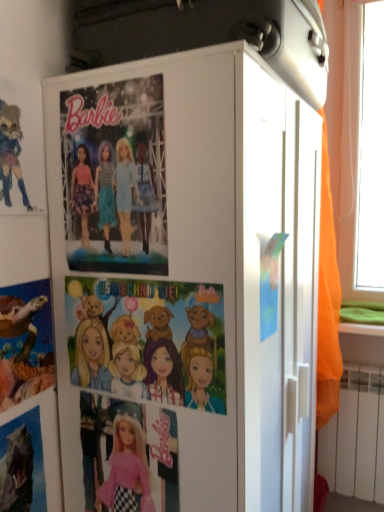
What is the approximate height of watercolor paper doll at upper left?

The height of watercolor paper doll at upper left is 12.39 inches.

Measure the distance between cartoon paper comic at center, placed as the third comic book when sorted from left to right, and camera.

The depth of cartoon paper comic at center, placed as the third comic book when sorted from left to right, is 33.86 inches.

What are the coordinates of `watercolor paper doll at upper left` in the screenshot? It's located at (11, 153).

From the image's perspective, is orange fabric curtain at right above or below white matte cabinet at center?

Clearly, from the image's perspective, orange fabric curtain at right is above white matte cabinet at center.

You are a GUI agent. You are given a task and a screenshot of the screen. Output one action in this format:
    pyautogui.click(x=<x>, y=<y>)
    Task: Click on the cabinetry that is below the orange fabric curtain at right (from the image's perspective)
    Image resolution: width=384 pixels, height=512 pixels.
    Given the screenshot: What is the action you would take?
    pyautogui.click(x=185, y=281)

Do you think orange fabric curtain at right is within white matte cabinet at center, or outside of it?

orange fabric curtain at right is not enclosed by white matte cabinet at center.

Considering the sizes of objects shiny metallic dinosaur at lower left, which appears as the 2th comic book when viewed from the left, and white matte cabinet at center in the image provided, who is shorter, shiny metallic dinosaur at lower left, which appears as the 2th comic book when viewed from the left, or white matte cabinet at center?

Standing shorter between the two is shiny metallic dinosaur at lower left, which appears as the 2th comic book when viewed from the left.

Considering the points (17, 426) and (179, 349), which point is behind, point (17, 426) or point (179, 349)?

The point (17, 426) is behind.

From the image's perspective, which object appears higher, shiny metallic dinosaur at lower left, which appears as the 2th comic book when viewed from the left, or white matte cabinet at center?

white matte cabinet at center.

From the image's perspective, which is below, orange fabric curtain at right or matte plastic turtle at lower left, arranged as the first comic book when viewed from the left?

matte plastic turtle at lower left, arranged as the first comic book when viewed from the left, from the image's perspective.

From a real-world perspective, who is located higher, orange fabric curtain at right or matte plastic turtle at lower left, arranged as the first comic book when viewed from the left?

orange fabric curtain at right, from a real-world perspective.

Measure the distance from orange fabric curtain at right to matte plastic turtle at lower left, which ranks as the 3th comic book in right-to-left order.

orange fabric curtain at right is 1.06 meters away from matte plastic turtle at lower left, which ranks as the 3th comic book in right-to-left order.

Is orange fabric curtain at right wider or thinner than matte plastic turtle at lower left, which ranks as the 3th comic book in right-to-left order?

Clearly, orange fabric curtain at right has more width compared to matte plastic turtle at lower left, which ranks as the 3th comic book in right-to-left order.

Is matte paper poster at center positioned far away from shiny metallic dinosaur at lower left, which appears as the 2th comic book when viewed from the left?

No.

Consider the image. Is matte paper poster at center not within shiny metallic dinosaur at lower left, which appears as the 2th comic book when viewed from the left?

Yes, matte paper poster at center is outside of shiny metallic dinosaur at lower left, which appears as the 2th comic book when viewed from the left.

Considering the relative positions of matte paper poster at center and shiny metallic dinosaur at lower left, which is counted as the 2th comic book, starting from the right, in the image provided, is matte paper poster at center to the left or to the right of shiny metallic dinosaur at lower left, which is counted as the 2th comic book, starting from the right,?

matte paper poster at center is to the right of shiny metallic dinosaur at lower left, which is counted as the 2th comic book, starting from the right.

How much distance is there between matte plastic turtle at lower left, which ranks as the 3th comic book in right-to-left order, and white matte cabinet at center?

matte plastic turtle at lower left, which ranks as the 3th comic book in right-to-left order, and white matte cabinet at center are 13.66 inches apart.

Is matte plastic turtle at lower left, which ranks as the 3th comic book in right-to-left order, directly adjacent to white matte cabinet at center?

They are not placed beside each other.

What's the angular difference between matte plastic turtle at lower left, which ranks as the 3th comic book in right-to-left order, and white matte cabinet at center's facing directions?

There is a 0.781-degree angle between the facing directions of matte plastic turtle at lower left, which ranks as the 3th comic book in right-to-left order, and white matte cabinet at center.

In terms of width, does matte plastic turtle at lower left, which ranks as the 3th comic book in right-to-left order, look wider or thinner when compared to white matte cabinet at center?

In the image, matte plastic turtle at lower left, which ranks as the 3th comic book in right-to-left order, appears to be more narrow than white matte cabinet at center.

Could you measure the distance between watercolor paper doll at upper left and shiny metallic dinosaur at lower left, which appears as the 2th comic book when viewed from the left?

23.68 inches.

Consider the image. Is shiny metallic dinosaur at lower left, which appears as the 2th comic book when viewed from the left, at the back of watercolor paper doll at upper left?

No, shiny metallic dinosaur at lower left, which appears as the 2th comic book when viewed from the left, is not at the back of watercolor paper doll at upper left.

Does point (5, 180) lie in front of point (24, 472)?

Yes, point (5, 180) is closer to viewer.

Which of these two, watercolor paper doll at upper left or shiny metallic dinosaur at lower left, which appears as the 2th comic book when viewed from the left, is wider?

shiny metallic dinosaur at lower left, which appears as the 2th comic book when viewed from the left.

From the matte plastic turtle at lower left, arranged as the first comic book when viewed from the left, count 1st comic books backward and point to it. Please provide its 2D coordinates.

[(22, 464)]

Based on the photo, from a real-world perspective, is matte plastic turtle at lower left, which ranks as the 3th comic book in right-to-left order, located beneath shiny metallic dinosaur at lower left, which is counted as the 2th comic book, starting from the right?

No, from a real-world perspective, matte plastic turtle at lower left, which ranks as the 3th comic book in right-to-left order, is not below shiny metallic dinosaur at lower left, which is counted as the 2th comic book, starting from the right.

Is matte plastic turtle at lower left, which ranks as the 3th comic book in right-to-left order, situated inside shiny metallic dinosaur at lower left, which is counted as the 2th comic book, starting from the right, or outside?

matte plastic turtle at lower left, which ranks as the 3th comic book in right-to-left order, exists outside the volume of shiny metallic dinosaur at lower left, which is counted as the 2th comic book, starting from the right.

Could you tell me if matte plastic turtle at lower left, which ranks as the 3th comic book in right-to-left order, is turned towards shiny metallic dinosaur at lower left, which appears as the 2th comic book when viewed from the left?

No, matte plastic turtle at lower left, which ranks as the 3th comic book in right-to-left order, is not aimed at shiny metallic dinosaur at lower left, which appears as the 2th comic book when viewed from the left.

What are the coordinates of `curtain on the right of white matte cabinet at center` in the screenshot? It's located at point(327,300).

This screenshot has width=384, height=512. In the image, there is a shiny metallic dinosaur at lower left, which appears as the 2th comic book when viewed from the left. Find the location of `cabinetry above it (from the image's perspective)`. cabinetry above it (from the image's perspective) is located at coordinates (185, 281).

Estimate the real-world distances between objects in this image. Which object is closer to orange fabric curtain at right, matte paper poster at center or white matte cabinet at center?

white matte cabinet at center.

Looking at the image, which one is located further to watercolor paper doll at upper left, cartoon paper comic at center, which ranks as the 1th comic book in right-to-left order, or white matte cabinet at center?

white matte cabinet at center is positioned further to the anchor watercolor paper doll at upper left.

Based on their spatial positions, is white matte cabinet at center or cartoon paper comic at center, placed as the third comic book when sorted from left to right, further from shiny metallic dinosaur at lower left, which is counted as the 2th comic book, starting from the right?

white matte cabinet at center lies further to shiny metallic dinosaur at lower left, which is counted as the 2th comic book, starting from the right, than the other object.

Looking at the image, which one is located further to orange fabric curtain at right, watercolor paper doll at upper left or shiny metallic dinosaur at lower left, which is counted as the 2th comic book, starting from the right?

watercolor paper doll at upper left is further to orange fabric curtain at right.

Looking at the image, which one is located closer to watercolor paper doll at upper left, white matte cabinet at center or matte plastic turtle at lower left, which ranks as the 3th comic book in right-to-left order?

matte plastic turtle at lower left, which ranks as the 3th comic book in right-to-left order, is positioned closer to the anchor watercolor paper doll at upper left.

Looking at the image, which one is located closer to shiny metallic dinosaur at lower left, which is counted as the 2th comic book, starting from the right, matte paper poster at center or white matte cabinet at center?

The object closer to shiny metallic dinosaur at lower left, which is counted as the 2th comic book, starting from the right, is white matte cabinet at center.

Considering their positions, is matte plastic turtle at lower left, which ranks as the 3th comic book in right-to-left order, positioned closer to matte paper poster at center than cartoon paper comic at center, placed as the third comic book when sorted from left to right?

Based on the image, cartoon paper comic at center, placed as the third comic book when sorted from left to right, appears to be nearer to matte paper poster at center.

Considering their positions, is watercolor paper doll at upper left positioned further to shiny metallic dinosaur at lower left, which appears as the 2th comic book when viewed from the left, than matte plastic turtle at lower left, which ranks as the 3th comic book in right-to-left order?

watercolor paper doll at upper left is positioned further to the anchor shiny metallic dinosaur at lower left, which appears as the 2th comic book when viewed from the left.

The height and width of the screenshot is (512, 384). I want to click on comic book situated between shiny metallic dinosaur at lower left, which is counted as the 2th comic book, starting from the right, and white matte cabinet at center from left to right, so click(150, 339).

The width and height of the screenshot is (384, 512). Find the location of `cabinetry between matte paper poster at center and orange fabric curtain at right in the horizontal direction`. cabinetry between matte paper poster at center and orange fabric curtain at right in the horizontal direction is located at coordinates pos(185,281).

Where is `poster between matte plastic turtle at lower left, arranged as the first comic book when viewed from the left, and orange fabric curtain at right, in the horizontal direction`? The width and height of the screenshot is (384, 512). poster between matte plastic turtle at lower left, arranged as the first comic book when viewed from the left, and orange fabric curtain at right, in the horizontal direction is located at coordinates (115, 177).

Identify the location of comic book that lies between watercolor paper doll at upper left and matte plastic turtle at lower left, arranged as the first comic book when viewed from the left, from top to bottom. (150, 339).